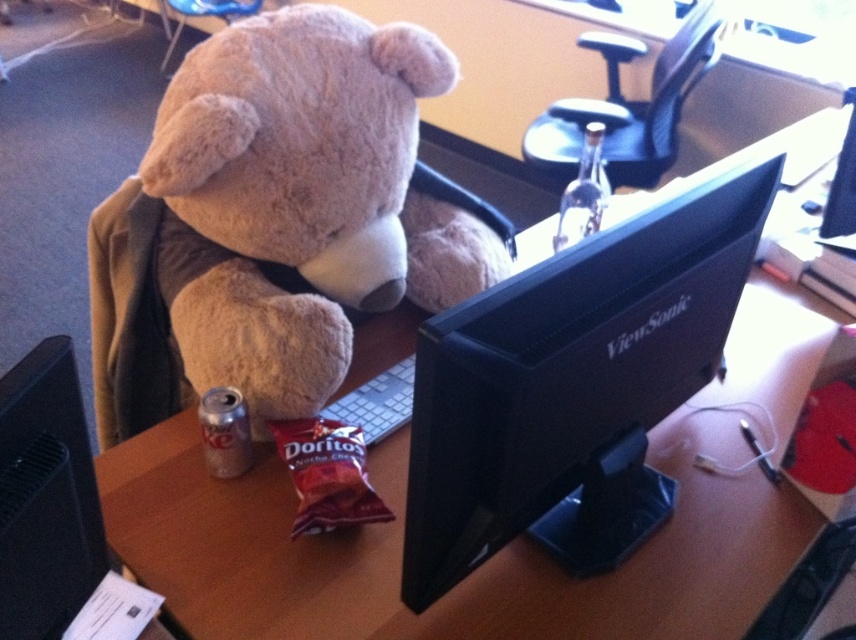
Is soft plush teddy bear at left shorter than black matte viewsonic monitor at center?

No, soft plush teddy bear at left is not shorter than black matte viewsonic monitor at center.

Is soft plush teddy bear at left positioned behind black matte viewsonic monitor at center?

Yes, it is behind black matte viewsonic monitor at center.

Between point (209, 38) and point (608, 321), which one is positioned in front?

Positioned in front is point (608, 321).

Locate an element on the screen. Image resolution: width=856 pixels, height=640 pixels. soft plush teddy bear at left is located at coordinates 302,200.

Between wooden at left and soft plush teddy bear at left, which one has less height?

Standing shorter between the two is wooden at left.

Is wooden at left further to camera compared to soft plush teddy bear at left?

No, wooden at left is in front of soft plush teddy bear at left.

At what (x,y) coordinates should I click in order to perform the action: click on wooden at left. Please return your answer as a coordinate pair (x, y). The height and width of the screenshot is (640, 856). Looking at the image, I should click on (501, 548).

The height and width of the screenshot is (640, 856). What are the coordinates of `black matte viewsonic monitor at center` in the screenshot? It's located at tap(568, 371).

Which is in front, point (605, 266) or point (705, 32)?

Point (605, 266)

Image resolution: width=856 pixels, height=640 pixels. In order to click on black matte viewsonic monitor at center in this screenshot , I will do `click(568, 371)`.